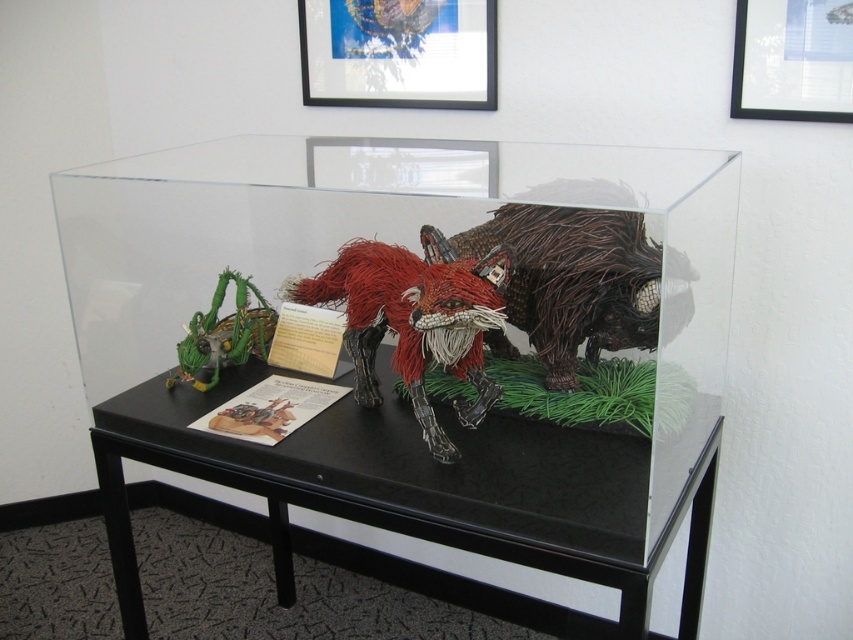
You are trying to place a rectangular gift card that is 10 cm wide. You want to place it on either the clear acrylic box at center or the matte black picture frame at upper center. Which surface can it fit on?

The clear acrylic box at center is wider than the matte black picture frame at upper center, so the gift card can fit on the clear acrylic box at center.

You are a photographer trying to capture the display case from the front. You notice two points marked in the image at coordinates point (494, 291) and point (759, 116). Which point should you focus on first to ensure both points are in sharp focus?

Point (494, 291) is closer to the camera than point (759, 116). To ensure both points are in sharp focus, focus on the closer point (494, 291) first.